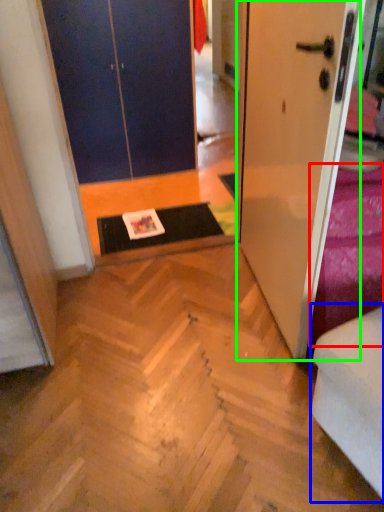
Question: Considering the real-world distances, which object is farthest from bedding (highlighted by a red box)? armchair (highlighted by a blue box) or door (highlighted by a green box)?

Choices:
 (A) armchair
 (B) door

Answer: (A)